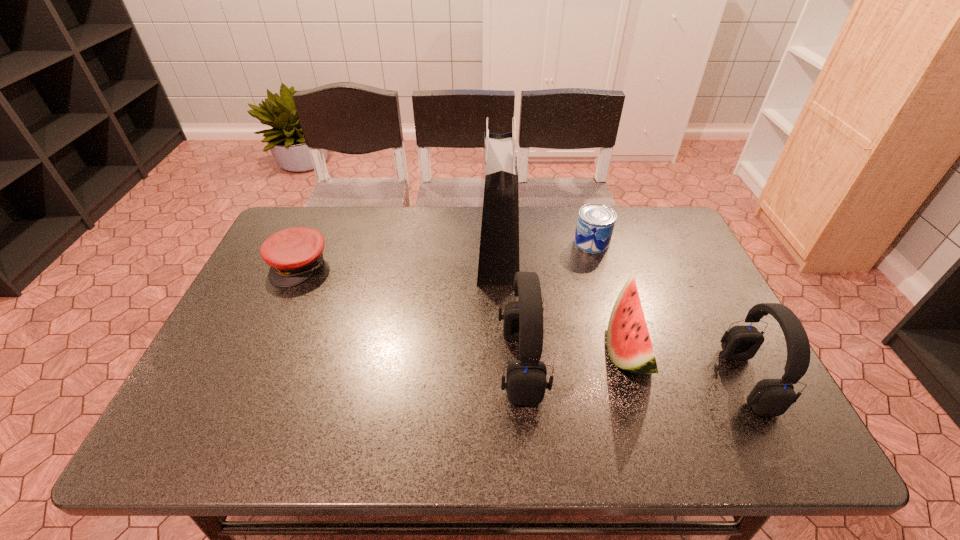
Image resolution: width=960 pixels, height=540 pixels. In order to click on the left headset in this screenshot , I will do `click(526, 382)`.

At what (x,y) coordinates should I click in order to perform the action: click on the second tallest object. Please return your answer as a coordinate pair (x, y). The width and height of the screenshot is (960, 540). Looking at the image, I should click on (526, 382).

Where is `the third tallest object`? The width and height of the screenshot is (960, 540). the third tallest object is located at coordinates (770, 397).

Identify the location of the rightmost object. (770, 397).

I want to click on the fifth tallest object, so click(x=595, y=224).

Identify the location of the tallest object. The width and height of the screenshot is (960, 540). (498, 216).

Where is `the shortest object`? This screenshot has width=960, height=540. the shortest object is located at coordinates click(293, 254).

This screenshot has width=960, height=540. In order to click on the leftmost object in this screenshot , I will do pos(293,254).

You are a GUI agent. You are given a task and a screenshot of the screen. Output one action in this format:
    pyautogui.click(x=<x>, y=<y>)
    Task: Click on the watermelon
    
    Given the screenshot: What is the action you would take?
    pyautogui.click(x=629, y=345)

I want to click on vacant region located 0.210m on the headband of the second tallest object, so click(x=411, y=364).